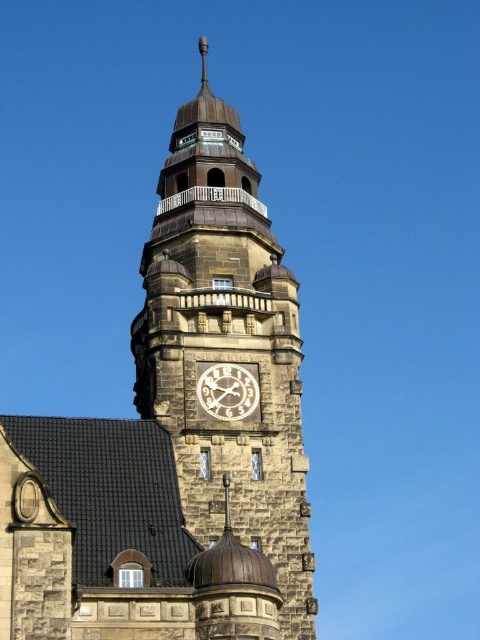
In the scene shown: Does stone clock tower at center have a lesser height compared to white wooden clock at center?

Incorrect, stone clock tower at center's height does not fall short of white wooden clock at center's.

Between stone clock tower at center and white wooden clock at center, which one is positioned higher?

stone clock tower at center is above.

This screenshot has height=640, width=480. What are the coordinates of `stone clock tower at center` in the screenshot? It's located at (176, 436).